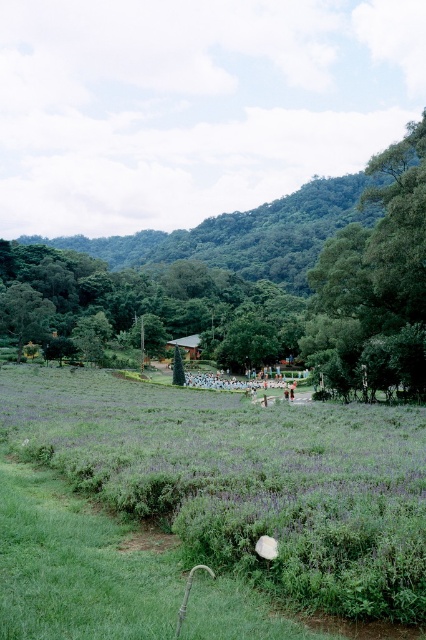
You are planning to set up a picnic blanket in the green grass at center. Considering the green leafy tree at center is nearby, will the tree provide shade over the picnic blanket? Please explain based on the distance between them.

Answer: The distance between the green grass at center and the green leafy tree at center is 558.57 feet. Since this distance is quite large, the tree will not provide shade over the picnic blanket.

You are standing in the serene landscape and want to place a small bench between the two points, point (224,572) and point (339,269). Which point should the bench be closer to in order to be visible from where you are standing?

The bench should be placed closer to point (224,572) because it is closer to the viewer than point (339,269), making it more visible from your current position.

You are a landscape architect planning to install a new pathway through the green grass at center and green leafy tree at center. Based on their heights, which one would require more clearance adjustments to accommodate?

The green leafy tree at center requires more clearance adjustments because it is taller than the green grass at center.